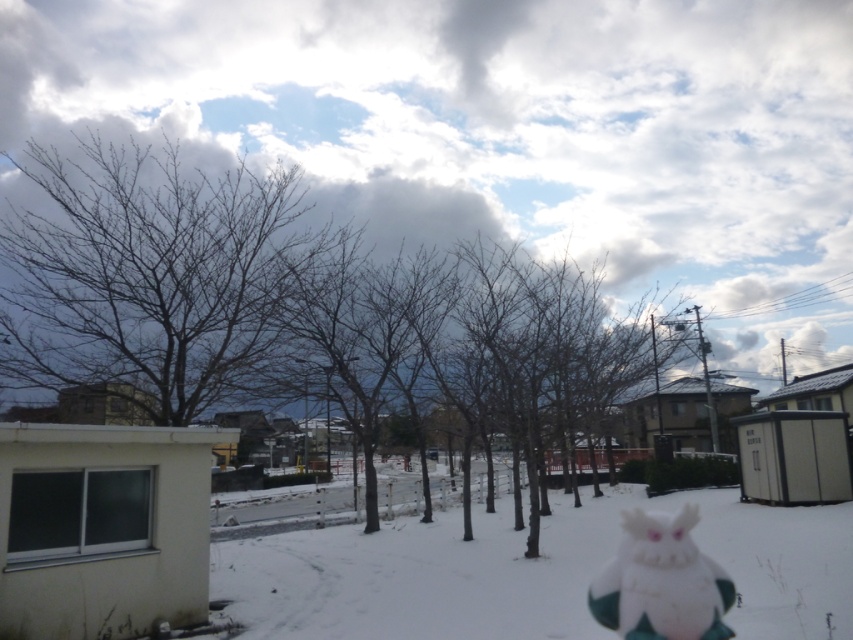
Can you confirm if bare branches at left is smaller than white plush at center?

Incorrect, bare branches at left is not smaller in size than white plush at center.

The width and height of the screenshot is (853, 640). Find the location of `bare branches at left`. bare branches at left is located at coordinates (148, 273).

Who is more distant from viewer, (212, 246) or (374, 634)?

The point (212, 246) is behind.

Can you confirm if bare branches at left is shorter than white fluffy snow at center?

In fact, bare branches at left may be taller than white fluffy snow at center.

Is point (230, 355) closer to camera compared to point (769, 529)?

That is False.

Where is `bare branches at left`? The height and width of the screenshot is (640, 853). bare branches at left is located at coordinates (148, 273).

Can you confirm if white fluffy snow at center is taller than white plush at center?

Indeed, white fluffy snow at center has a greater height compared to white plush at center.

Is point (718, 545) closer to viewer compared to point (636, 608)?

No, (718, 545) is behind (636, 608).

Locate an element on the screen. This screenshot has height=640, width=853. white fluffy snow at center is located at coordinates (531, 572).